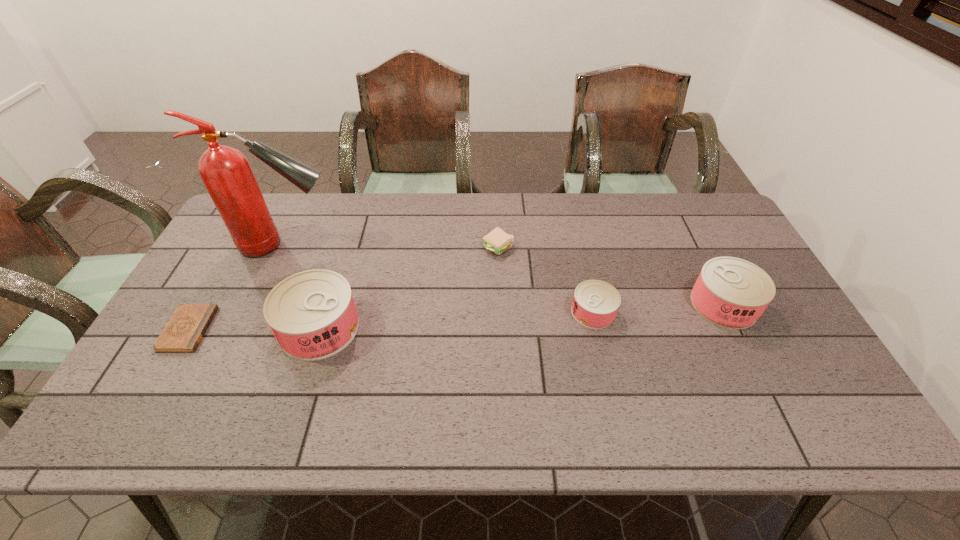
If equal spacing is desired by inserting an extra can among them, please point out a free spot for this new can. Please provide its 2D coordinates. Your answer should be formatted as a tuple, i.e. [(x, y)], where the tuple contains the x and y coordinates of a point satisfying the conditions above.

[(459, 320)]